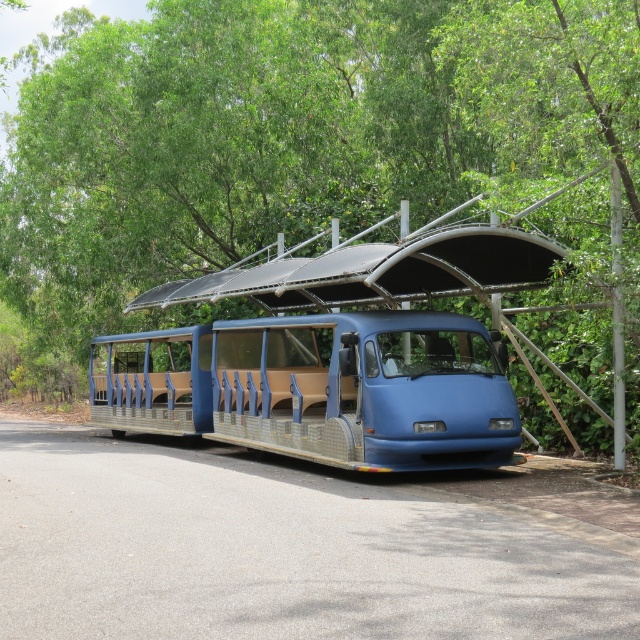
In the scene shown: What is the 2D coordinate of the green leafy tree at upper center in the image?

The green leafy tree at upper center is located at the 2D coordinate point of (x=296, y=138).